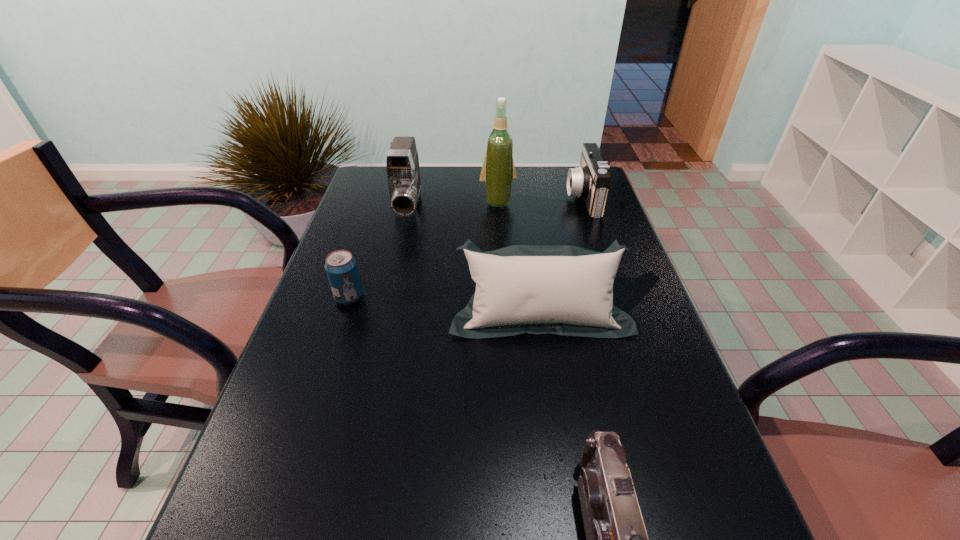
The image size is (960, 540). Identify the location of vacant space at the left edge of the desktop. (311, 501).

Where is `vacant position at the far left corner of the desktop`? The height and width of the screenshot is (540, 960). vacant position at the far left corner of the desktop is located at coordinates (360, 199).

At what (x,y) coordinates should I click in order to perform the action: click on vacant space at the far right corner. Please return your answer as a coordinate pair (x, y). Looking at the image, I should click on (566, 172).

You are a GUI agent. You are given a task and a screenshot of the screen. Output one action in this format:
    pyautogui.click(x=<x>, y=<y>)
    Task: Click on the empty space between the leftmost object and the tallest object
    
    Given the screenshot: What is the action you would take?
    pyautogui.click(x=423, y=249)

Where is `object that is the fifth closest one to the shortest camcorder`? This screenshot has height=540, width=960. object that is the fifth closest one to the shortest camcorder is located at coordinates (498, 171).

Identify which object is the fourth closest to the second camcorder from right to left. Please provide its 2D coordinates. Your answer should be formatted as a tuple, i.e. [(x, y)], where the tuple contains the x and y coordinates of a point satisfying the conditions above.

[(402, 165)]

The image size is (960, 540). What are the coordinates of `the closest camcorder to the shortest camcorder` in the screenshot? It's located at (591, 180).

Image resolution: width=960 pixels, height=540 pixels. In order to click on camcorder that is the third closest one to the wine bottle in this screenshot , I will do `click(616, 538)`.